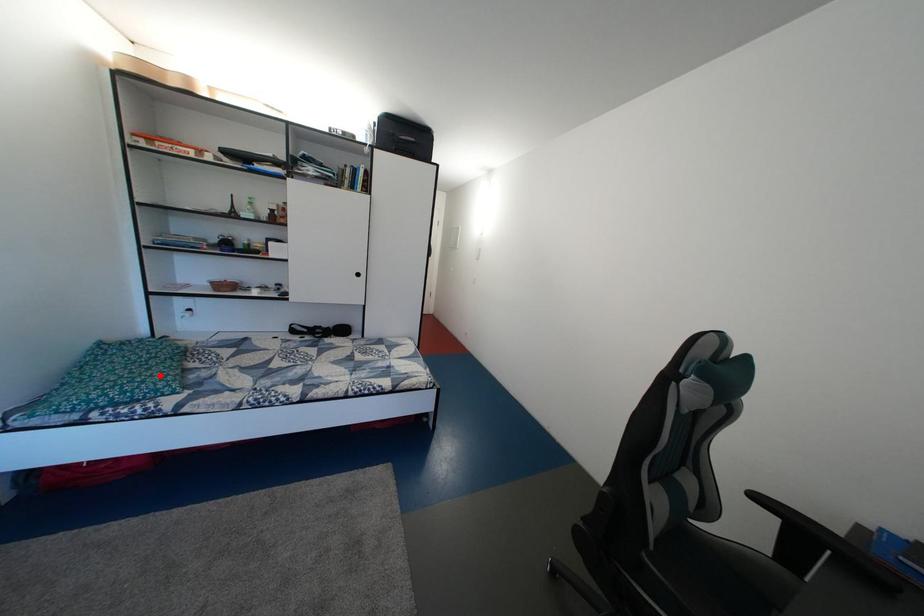
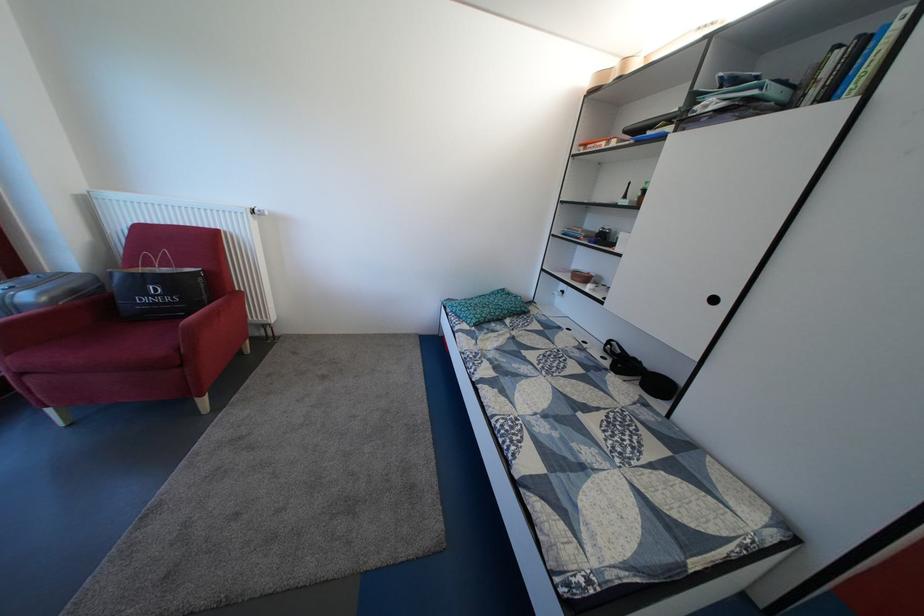
Locate, in the second image, the point that corresponds to the highlighted location in the first image.

(494, 314)